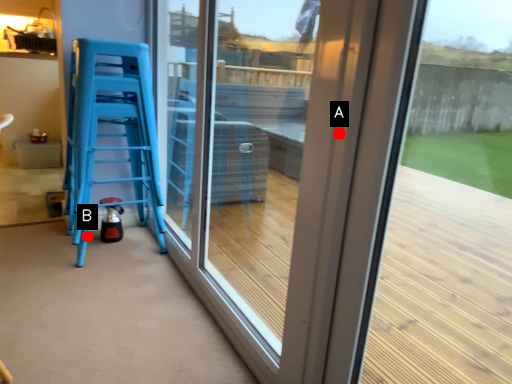
Question: Two points are circled on the image, labeled by A and B beside each circle. Which point is farther to the camera?

Choices:
 (A) A is further
 (B) B is further

Answer: (B)